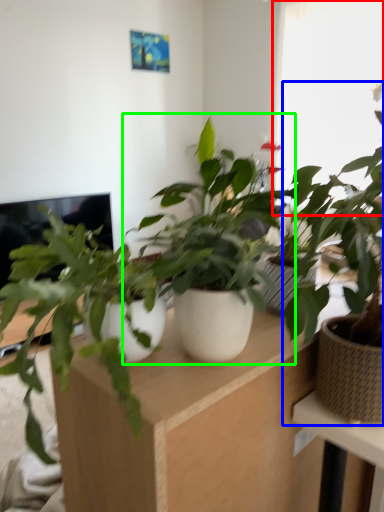
Question: Considering the real-world distances, which object is farthest from window (highlighted by a red box)? houseplant (highlighted by a blue box) or houseplant (highlighted by a green box)?

Choices:
 (A) houseplant
 (B) houseplant

Answer: (A)